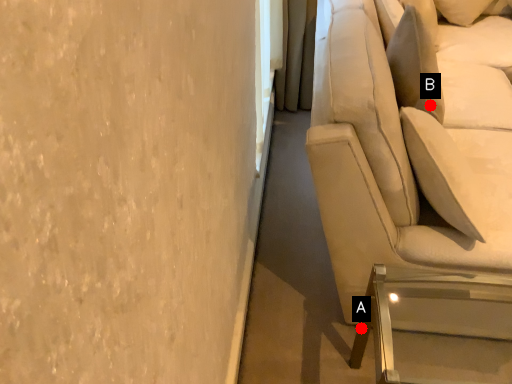
Question: Two points are circled on the image, labeled by A and B beside each circle. Among these points, which one is nearest to the camera?

Choices:
 (A) A is closer
 (B) B is closer

Answer: (A)